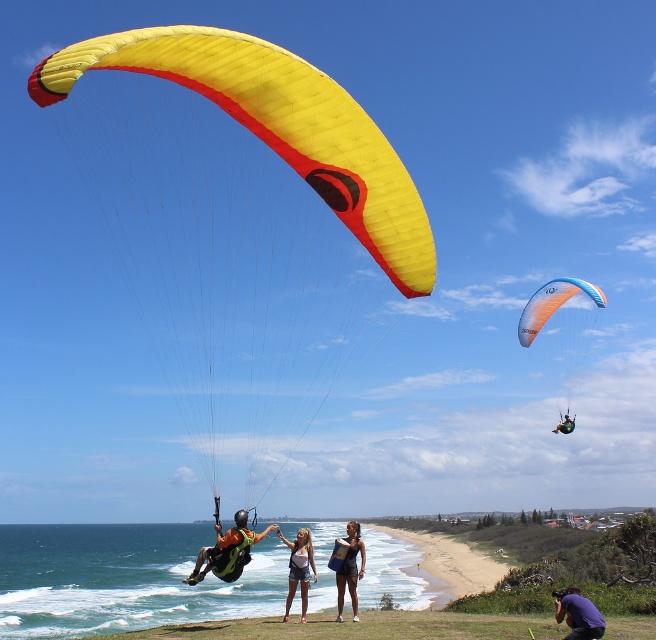
Question: Is green fabric parachute at lower left to the left of purple fabric camera at lower right from the viewer's perspective?

Choices:
 (A) no
 (B) yes

Answer: (B)

Question: Which is farther from the purple fabric camera at lower right?

Choices:
 (A) yellow matte parachute at center
 (B) translucent orange parachute at upper right

Answer: (A)

Question: Observing the image, what is the correct spatial positioning of green fabric parachute at lower left in reference to dark blue swimsuit at center?

Choices:
 (A) above
 (B) below

Answer: (B)

Question: Does green fabric parachute at lower left lie in front of green fabric parachute at upper center?

Choices:
 (A) no
 (B) yes

Answer: (B)

Question: Considering the real-world distances, which object is farthest from the denim shorts at center?

Choices:
 (A) yellow matte parachute at center
 (B) green fabric parachute at lower left

Answer: (A)

Question: Which point appears closest to the camera in this image?

Choices:
 (A) (565, 412)
 (B) (584, 332)
 (C) (602, 625)
 (D) (350, 525)

Answer: (C)